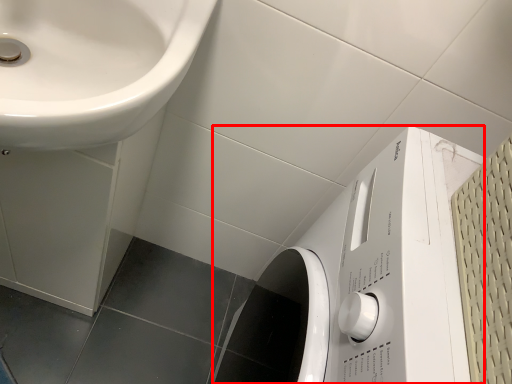
Question: From the image's perspective, considering the relative positions of washing machine (annotated by the red box) and sink in the image provided, where is washing machine (annotated by the red box) located with respect to the staircase?

Choices:
 (A) above
 (B) below

Answer: (B)